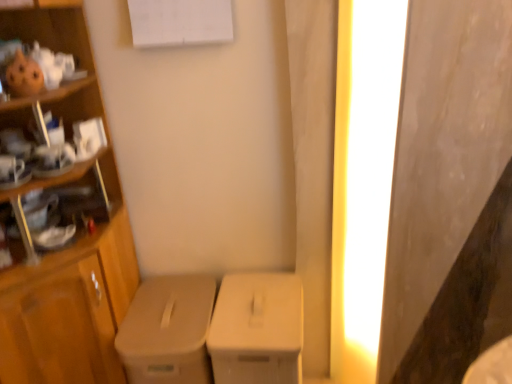
Question: From a real-world perspective, is white matte cardboard box at center, marked as the 2th cardboard box in a left-to-right arrangement, positioned under matte beige cardboard box at center, arranged as the second cardboard box when viewed from the right, based on gravity?

Choices:
 (A) no
 (B) yes

Answer: (B)

Question: Is matte beige cardboard box at center, which appears as the first cardboard box when viewed from the left, completely or partially inside white matte cardboard box at center, the 1th cardboard box positioned from the right?

Choices:
 (A) no
 (B) yes

Answer: (A)

Question: Is white matte cardboard box at center, marked as the 2th cardboard box in a left-to-right arrangement, with matte beige cardboard box at center, which appears as the first cardboard box when viewed from the left?

Choices:
 (A) yes
 (B) no

Answer: (B)

Question: Considering the relative sizes of white matte cardboard box at center, marked as the 2th cardboard box in a left-to-right arrangement, and matte beige cardboard box at center, which appears as the first cardboard box when viewed from the left, in the image provided, is white matte cardboard box at center, marked as the 2th cardboard box in a left-to-right arrangement, bigger than matte beige cardboard box at center, which appears as the first cardboard box when viewed from the left,?

Choices:
 (A) yes
 (B) no

Answer: (B)

Question: From the image's perspective, is white matte cardboard box at center, the 1th cardboard box positioned from the right, over matte beige cardboard box at center, which appears as the first cardboard box when viewed from the left?

Choices:
 (A) no
 (B) yes

Answer: (B)

Question: Does white matte cardboard box at center, the 1th cardboard box positioned from the right, appear on the right side of matte beige cardboard box at center, arranged as the second cardboard box when viewed from the right?

Choices:
 (A) no
 (B) yes

Answer: (B)

Question: Is bright yellow light at right at the right side of matte beige cardboard box at center, arranged as the second cardboard box when viewed from the right?

Choices:
 (A) no
 (B) yes

Answer: (B)

Question: Is bright yellow light at right oriented away from matte beige cardboard box at center, arranged as the second cardboard box when viewed from the right?

Choices:
 (A) no
 (B) yes

Answer: (A)

Question: Could matte beige cardboard box at center, which appears as the first cardboard box when viewed from the left, be considered to be inside bright yellow light at right?

Choices:
 (A) yes
 (B) no

Answer: (B)

Question: Are bright yellow light at right and matte beige cardboard box at center, which appears as the first cardboard box when viewed from the left, making contact?

Choices:
 (A) no
 (B) yes

Answer: (A)

Question: From the image's perspective, would you say bright yellow light at right is shown under matte beige cardboard box at center, arranged as the second cardboard box when viewed from the right?

Choices:
 (A) yes
 (B) no

Answer: (B)

Question: Is bright yellow light at right wider than matte beige cardboard box at center, which appears as the first cardboard box when viewed from the left?

Choices:
 (A) yes
 (B) no

Answer: (B)

Question: Is the position of matte beige cardboard box at center, arranged as the second cardboard box when viewed from the right, more distant than that of bright yellow light at right?

Choices:
 (A) no
 (B) yes

Answer: (B)